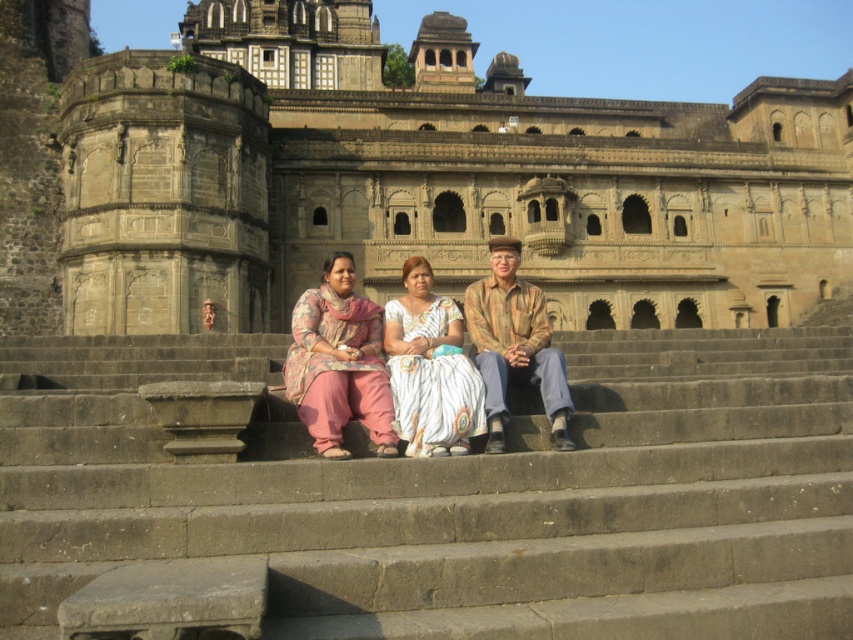
Question: In this image, where is brown stone stairs at center located relative to plaid fabric shirt at center?

Choices:
 (A) above
 (B) below

Answer: (B)

Question: Which object is farther from the camera taking this photo?

Choices:
 (A) white textured saree at center
 (B) plaid fabric shirt at center

Answer: (B)

Question: Estimate the real-world distances between objects in this image. Which object is closer to the brown stone stairs at center?

Choices:
 (A) stone carved palace at center
 (B) plaid fabric shirt at center

Answer: (B)

Question: Estimate the real-world distances between objects in this image. Which object is farther from the matte pink pants at center?

Choices:
 (A) white textured saree at center
 (B) plaid fabric shirt at center
 (C) stone carved palace at center

Answer: (C)

Question: Does stone carved palace at center have a larger size compared to white textured saree at center?

Choices:
 (A) yes
 (B) no

Answer: (A)

Question: Does brown stone stairs at center appear on the left side of matte pink pants at center?

Choices:
 (A) no
 (B) yes

Answer: (A)